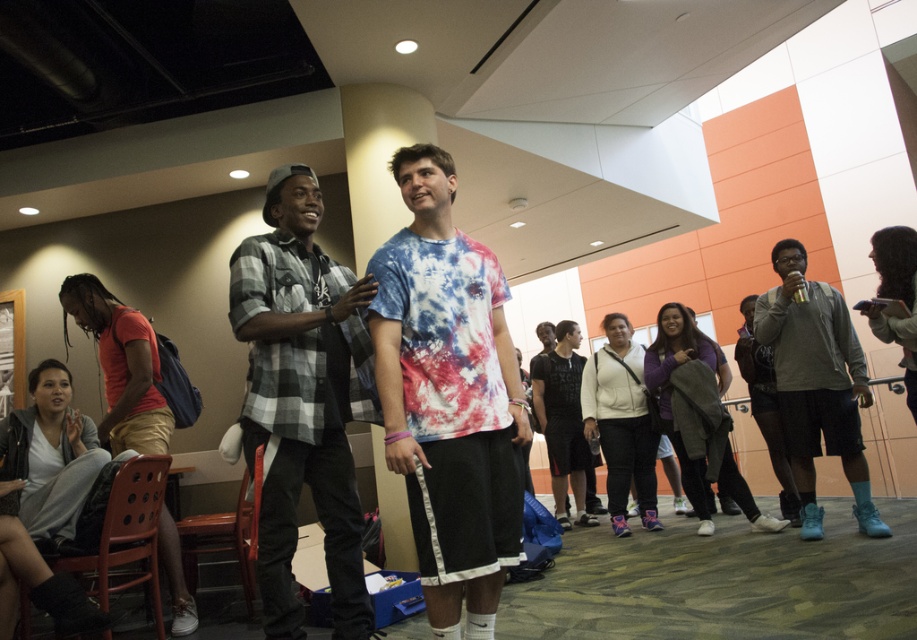
Question: In this image, where is brown plastic chair at lower left located relative to wooden chair at lower left?

Choices:
 (A) left
 (B) right

Answer: (A)

Question: Does tie-dye fabric shirt at center have a larger size compared to plaid flannel shirt at center?

Choices:
 (A) yes
 (B) no

Answer: (B)

Question: Considering the real-world distances, which object is farthest from the gray fleece jacket at right?

Choices:
 (A) brown wood chair at lower left
 (B) brown plastic chair at lower left
 (C) tie-dye fabric shirt at center
 (D) wooden chair at lower left

Answer: (B)

Question: Which of these objects is positioned closest to the gray fleece jacket at right?

Choices:
 (A) tie-dye fabric shirt at center
 (B) plaid flannel shirt at center
 (C) brown plastic chair at lower left

Answer: (A)

Question: Which object is positioned closest to the brown plastic chair at lower left?

Choices:
 (A) brown wood chair at lower left
 (B) plaid flannel shirt at center
 (C) wooden chair at lower left

Answer: (C)

Question: Observing the image, what is the correct spatial positioning of gray fleece jacket at right in reference to brown plastic chair at lower left?

Choices:
 (A) below
 (B) above

Answer: (B)